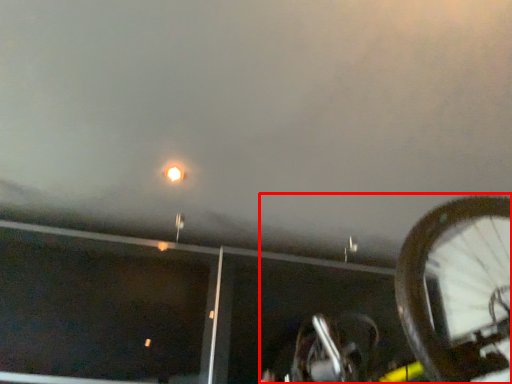
Question: In this image, where is bicycle (annotated by the red box) located relative to street light?

Choices:
 (A) left
 (B) right

Answer: (B)